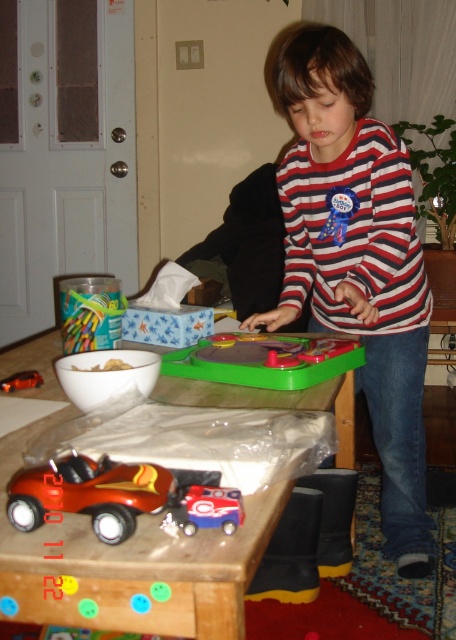
The child is trying to reach the metallic red toy car at lower left from the striped cotton shirt at center. Considering their heights, can the child reach the toy car without moving?

The striped cotton shirt at center is much taller than the metallic red toy car at lower left, so the child might need to bend down or move closer to reach the toy car.

You are a parent helping your child organize their toys. You need to place the metallic red toy car at lower left and the blue plastic toy car at center into a storage bin. Which toy should you pick up first if you want to place them in the bin starting from the leftmost toy first?

The metallic red toy car at lower left should be picked up first because it is positioned on the left side of the blue plastic toy car at center, making it the leftmost toy.

You are helping a child organize their play area. The striped cotton shirt at center and the green plastic playset at center are both on the table. Which item takes up more horizontal space on the table?

The striped cotton shirt at center takes up more horizontal space on the table because its width is larger than that of the green plastic playset at center.